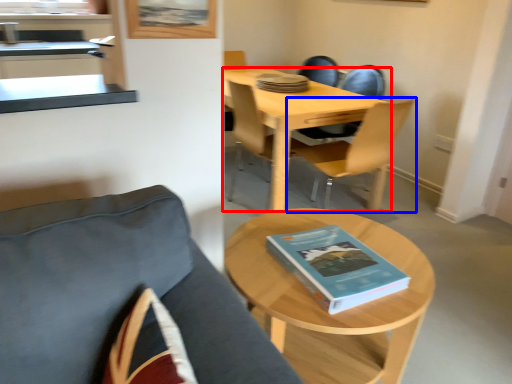
Question: Among these objects, which one is farthest to the camera, desk (highlighted by a red box) or chair (highlighted by a blue box)?

Choices:
 (A) desk
 (B) chair

Answer: (A)